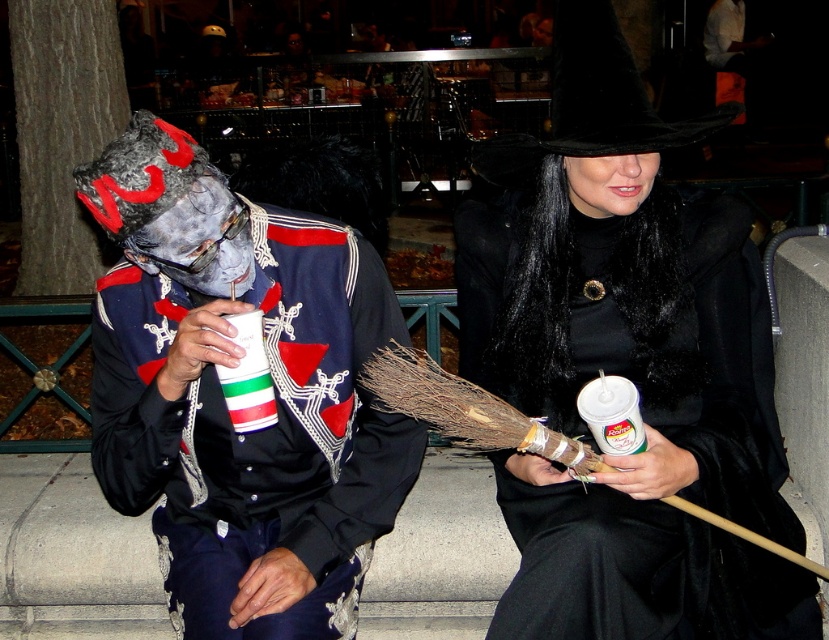
Can you confirm if black fur coat at center is positioned to the left of matte black costume at center?

In fact, black fur coat at center is to the right of matte black costume at center.

This screenshot has height=640, width=829. What do you see at coordinates (626, 365) in the screenshot? I see `black fur coat at center` at bounding box center [626, 365].

Where is `black fur coat at center`? Image resolution: width=829 pixels, height=640 pixels. black fur coat at center is located at coordinates (626, 365).